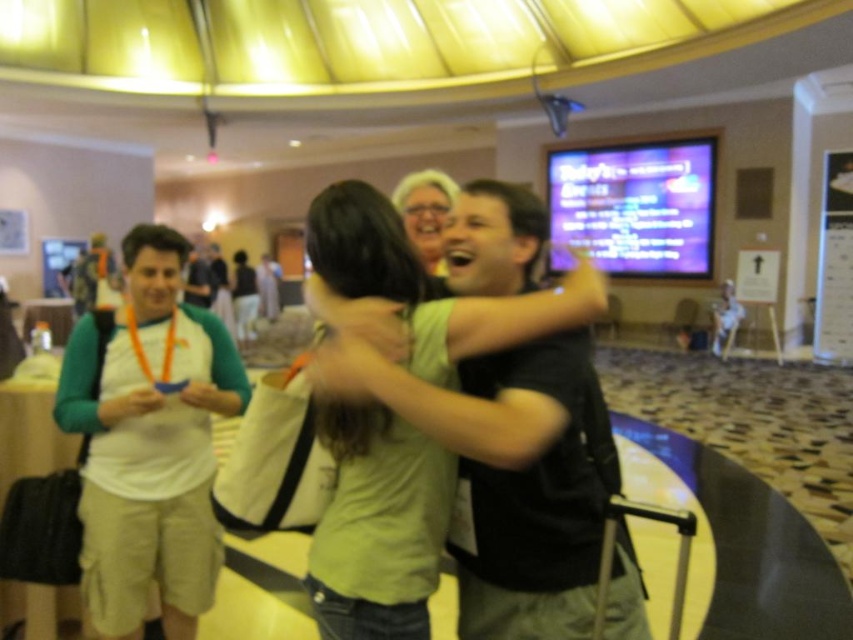
Is point (334, 413) closer to viewer compared to point (83, 524)?

Yes, point (334, 413) is closer to viewer.

Measure the distance from green matte shirt at center to white fabric shirt at left.

They are 35.98 inches apart.

Locate an element on the screen. This screenshot has width=853, height=640. green matte shirt at center is located at coordinates (405, 403).